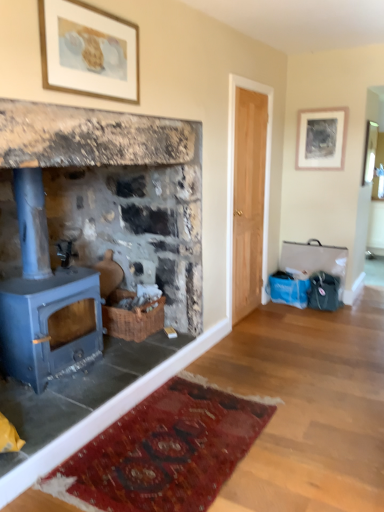
Question: Is blue painted wood stove at left thinner than gold-framed artwork at upper center, which is the 2th picture frame from back to front?

Choices:
 (A) yes
 (B) no

Answer: (B)

Question: Can we say blue painted wood stove at left lies outside gold-framed artwork at upper center, placed as the second picture frame when sorted from right to left?

Choices:
 (A) no
 (B) yes

Answer: (B)

Question: Considering the relative sizes of blue painted wood stove at left and gold-framed artwork at upper center, placed as the second picture frame when sorted from right to left, in the image provided, is blue painted wood stove at left smaller than gold-framed artwork at upper center, placed as the second picture frame when sorted from right to left,?

Choices:
 (A) no
 (B) yes

Answer: (A)

Question: Does blue painted wood stove at left lie behind gold-framed artwork at upper center, arranged as the first picture frame when viewed from the front?

Choices:
 (A) yes
 (B) no

Answer: (B)

Question: Does blue painted wood stove at left have a greater width compared to gold-framed artwork at upper center, placed as the second picture frame when sorted from right to left?

Choices:
 (A) no
 (B) yes

Answer: (B)

Question: Which is correct: gold-framed artwork at upper center, which is the 2th picture frame from back to front, is inside matte silver picture frame at upper right, the first picture frame positioned from the right, or outside of it?

Choices:
 (A) inside
 (B) outside

Answer: (B)

Question: Based on their sizes in the image, would you say gold-framed artwork at upper center, placed as the second picture frame when sorted from right to left, is bigger or smaller than matte silver picture frame at upper right, the first picture frame positioned from the right?

Choices:
 (A) big
 (B) small

Answer: (A)

Question: In terms of height, does gold-framed artwork at upper center, which is the 2th picture frame from back to front, look taller or shorter compared to matte silver picture frame at upper right, the 2th picture frame positioned from the front?

Choices:
 (A) tall
 (B) short

Answer: (B)

Question: Does point (134, 77) appear closer or farther from the camera than point (312, 146)?

Choices:
 (A) closer
 (B) farther

Answer: (A)

Question: From the image's perspective, is matte silver picture frame at upper right, the first picture frame positioned from the right, above or below blue painted wood stove at left?

Choices:
 (A) above
 (B) below

Answer: (A)

Question: Is matte silver picture frame at upper right, the 2th picture frame positioned from the front, bigger or smaller than blue painted wood stove at left?

Choices:
 (A) big
 (B) small

Answer: (B)

Question: Is point (332, 156) positioned closer to the camera than point (153, 254)?

Choices:
 (A) closer
 (B) farther

Answer: (B)

Question: From a real-world perspective, is matte silver picture frame at upper right, the 2th picture frame positioned from the front, above or below blue painted wood stove at left?

Choices:
 (A) above
 (B) below

Answer: (A)

Question: Is matte blue wood burning stove at left wider or thinner than gold-framed artwork at upper center, which is counted as the 1th picture frame, starting from the left?

Choices:
 (A) thin
 (B) wide

Answer: (B)

Question: Considering their positions, is matte blue wood burning stove at left located in front of or behind gold-framed artwork at upper center, which is counted as the 1th picture frame, starting from the left?

Choices:
 (A) front
 (B) behind

Answer: (B)